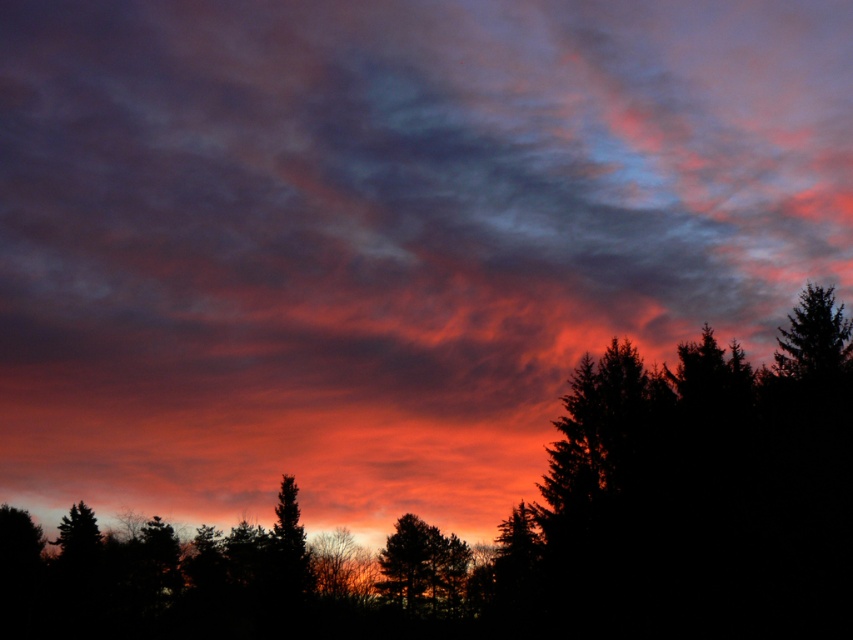
Who is lower down, silhouette evergreen tree at right or silhouette tree at center?

silhouette tree at center is below.

Which is in front, point (543, 557) or point (440, 561)?

Point (543, 557) is more forward.

Identify the location of silhouette evergreen tree at right. This screenshot has width=853, height=640. (701, 492).

Which is in front, point (368, 614) or point (413, 568)?

Positioned in front is point (368, 614).

Who is higher up, silhouette trees at center or silhouette tree at center?

silhouette trees at center is above.

Is point (592, 381) positioned in front of point (445, 602)?

Yes, point (592, 381) is closer to viewer.

At what (x,y) coordinates should I click in order to perform the action: click on silhouette trees at center. Please return your answer as a coordinate pair (x, y). The image size is (853, 640). Looking at the image, I should click on (532, 524).

Between silhouette trees at center and silhouette evergreen tree at right, which one has less height?

silhouette evergreen tree at right is shorter.

Which is behind, point (699, 534) or point (654, 484)?

The point (654, 484) is behind.

Locate an element on the screen. silhouette trees at center is located at coordinates (532, 524).